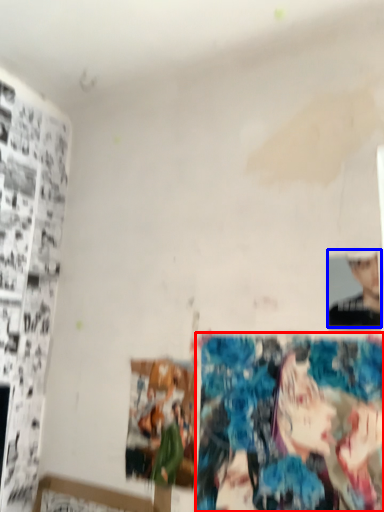
Question: Which object appears farthest to the camera in this image, reflection (highlighted by a red box) or person (highlighted by a blue box)?

Choices:
 (A) reflection
 (B) person

Answer: (B)